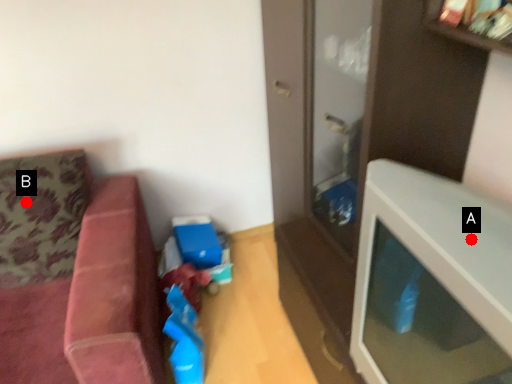
Question: Two points are circled on the image, labeled by A and B beside each circle. Which point is farther from the camera taking this photo?

Choices:
 (A) A is further
 (B) B is further

Answer: (B)